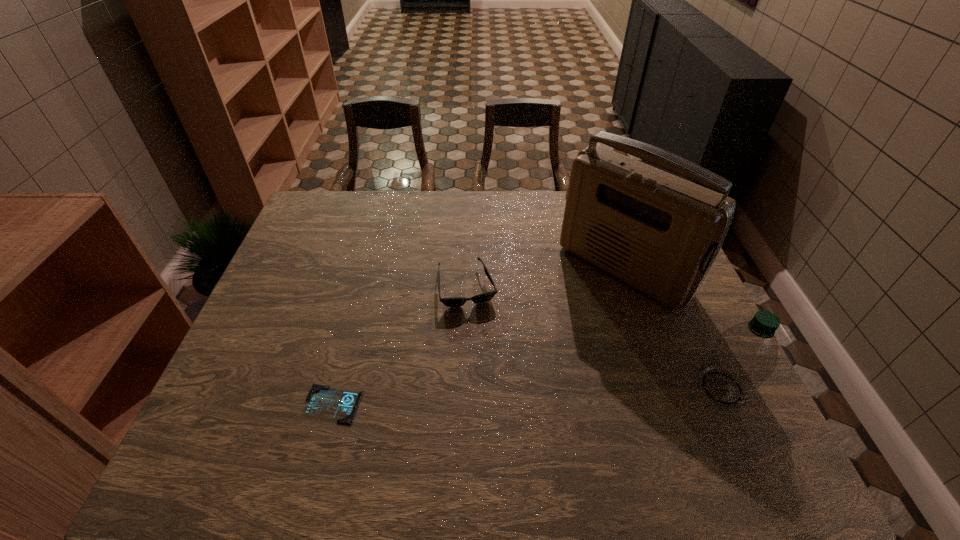
The height and width of the screenshot is (540, 960). Identify the location of free space on the desktop that is between the shortest object and the water bottle and is positioned on the front-facing side of the radio receiver. (482, 398).

I want to click on free space on the desktop that is between the shortest object and the water bottle and is positioned on the front-facing side of the sunglasses, so click(496, 397).